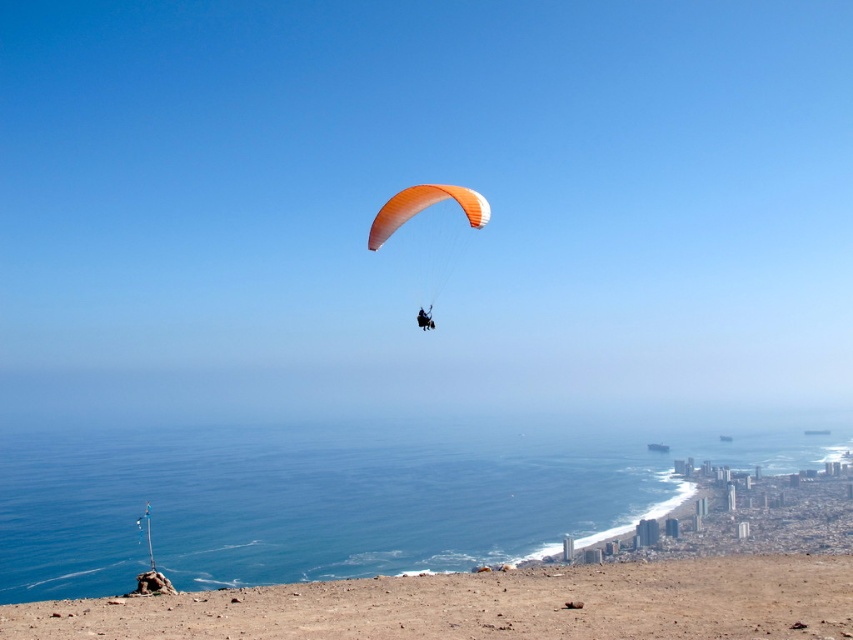
Question: Which of the following is the closest to the observer?

Choices:
 (A) (282, 604)
 (B) (456, 198)
 (C) (444, 429)

Answer: (A)

Question: Is blue water at lower center above orange fabric parachute at upper center?

Choices:
 (A) yes
 (B) no

Answer: (B)

Question: Which point is farther to the camera?

Choices:
 (A) brown sandy beach at lower center
 (B) orange nylon parachute at center

Answer: (B)

Question: Does blue water at lower center appear on the right side of brown sandy beach at lower center?

Choices:
 (A) yes
 (B) no

Answer: (B)

Question: Which object is closer to the camera taking this photo?

Choices:
 (A) brown sandy beach at lower center
 (B) blue water at lower center
 (C) orange nylon parachute at center
 (D) orange fabric parachute at upper center

Answer: (A)

Question: Considering the relative positions of blue water at lower center and brown sandy beach at lower center in the image provided, where is blue water at lower center located with respect to brown sandy beach at lower center?

Choices:
 (A) left
 (B) right

Answer: (A)